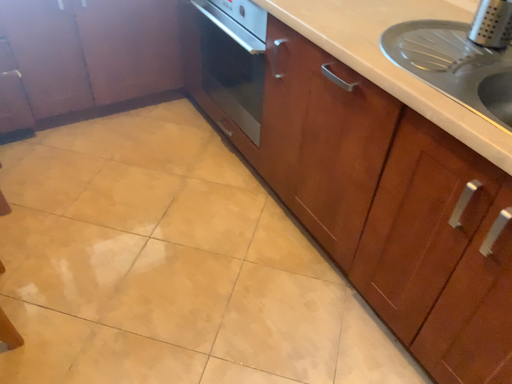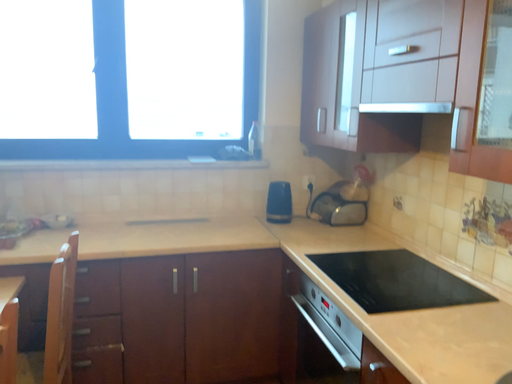
Question: How did the camera likely rotate when shooting the video?

Choices:
 (A) rotated upward
 (B) rotated downward

Answer: (A)